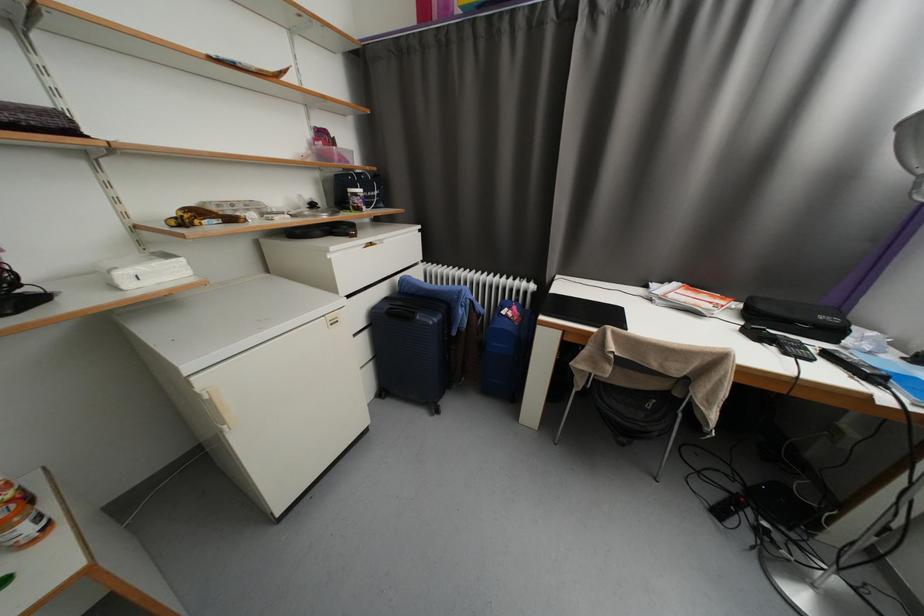
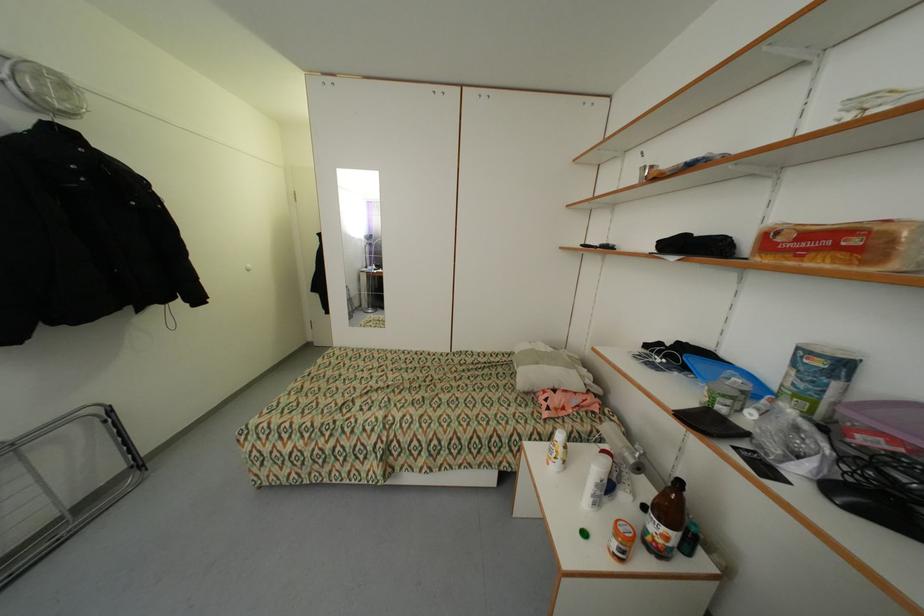
Where in the second image is the point corresponding to (45,517) from the first image?

(627, 552)